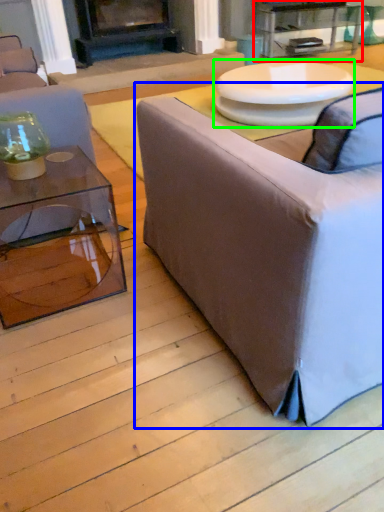
Question: Estimate the real-world distances between objects in this image. Which object is closer to table (highlighted by a red box), studio couch (highlighted by a blue box) or round table (highlighted by a green box)?

Choices:
 (A) studio couch
 (B) round table

Answer: (B)